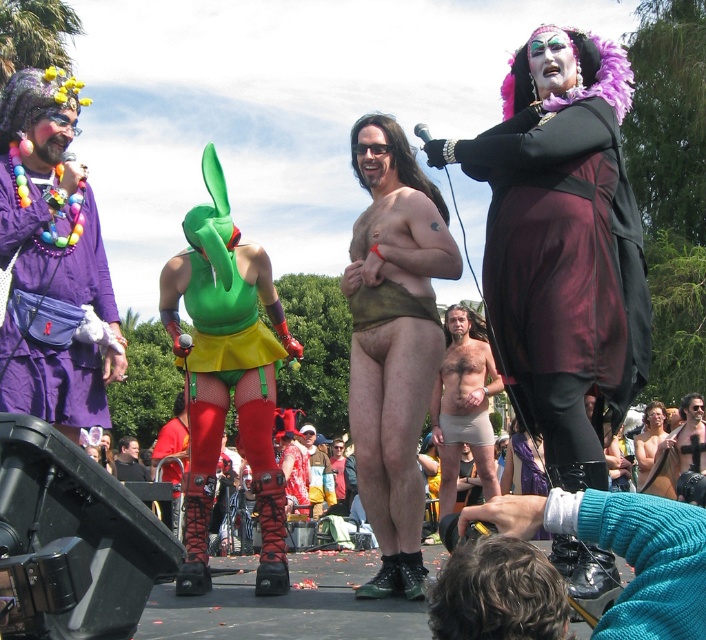
In the scene shown: Does brown leather shorts at center have a greater width compared to purple fabric fanny pack at left?

Indeed, brown leather shorts at center has a greater width compared to purple fabric fanny pack at left.

Between point (357, 449) and point (102, 269), which one is positioned behind?

The point (357, 449) is more distant.

Identify the location of brown leather shorts at center. This screenshot has height=640, width=706. (393, 340).

Is velvet maroon dress at upper right further to the viewer compared to shiny metallic shorts at center?

That is False.

Does velvet maroon dress at upper right appear on the right side of shiny metallic shorts at center?

Correct, you'll find velvet maroon dress at upper right to the right of shiny metallic shorts at center.

Between point (575, 294) and point (311, 467), which one is positioned in front?

Positioned in front is point (575, 294).

Where is `velvet maroon dress at upper right`? velvet maroon dress at upper right is located at coordinates (562, 244).

Which is behind, point (1, 216) or point (484, 403)?

Positioned behind is point (484, 403).

Can you confirm if purple fabric fanny pack at left is thinner than skinny beige shorts at center?

Yes.

You are a GUI agent. You are given a task and a screenshot of the screen. Output one action in this format:
    pyautogui.click(x=<x>, y=<y>)
    Task: Click on the purple fabric fanny pack at left
    
    Given the screenshot: What is the action you would take?
    pyautogui.click(x=54, y=385)